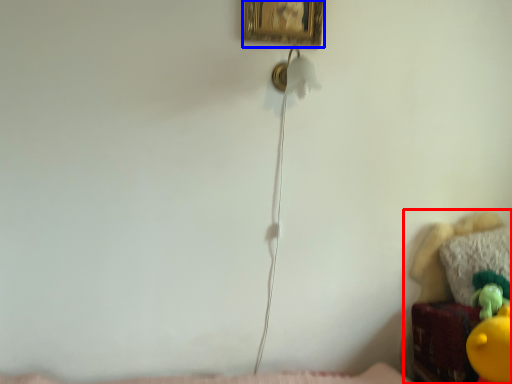
Question: Among these objects, which one is farthest to the camera, furniture (highlighted by a red box) or picture frame (highlighted by a blue box)?

Choices:
 (A) furniture
 (B) picture frame

Answer: (B)